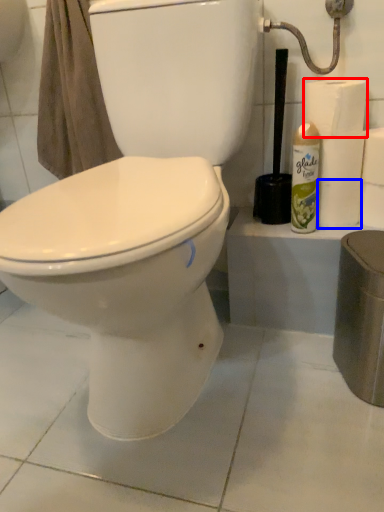
Question: Which object is closer to the camera taking this photo, toilet paper (highlighted by a red box) or toilet paper (highlighted by a blue box)?

Choices:
 (A) toilet paper
 (B) toilet paper

Answer: (A)